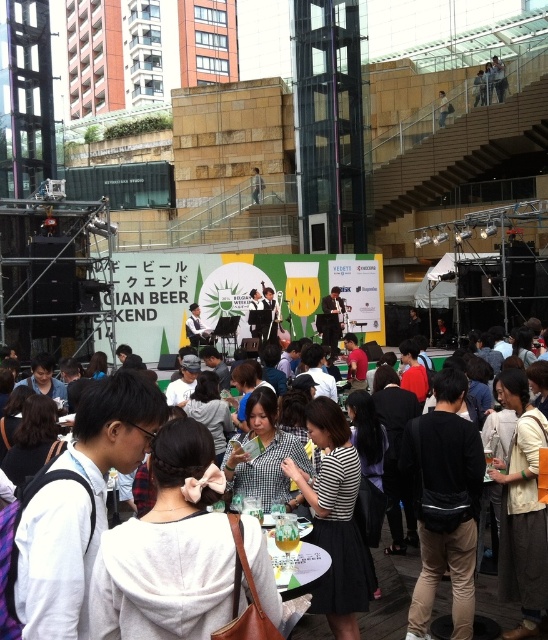
Who is higher up, light brown wooden chair at center or light brown leather bag at upper center?

light brown leather bag at upper center is higher up.

Measure the distance between light brown wooden chair at center and camera.

light brown wooden chair at center is 177.33 feet away from camera.

In order to click on light brown wooden chair at center in this screenshot , I will do `click(256, 186)`.